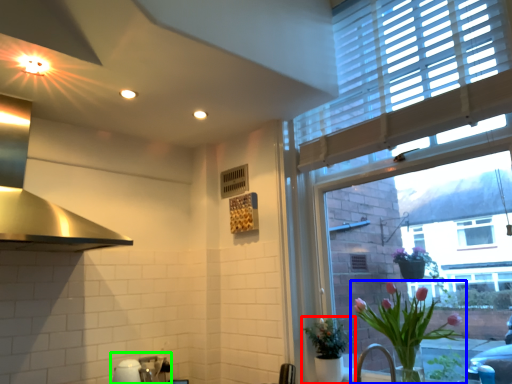
Question: Which object is positioned farthest from houseplant (highlighted by a red box)? Select from houseplant (highlighted by a blue box) and sink (highlighted by a green box).

Choices:
 (A) houseplant
 (B) sink

Answer: (B)